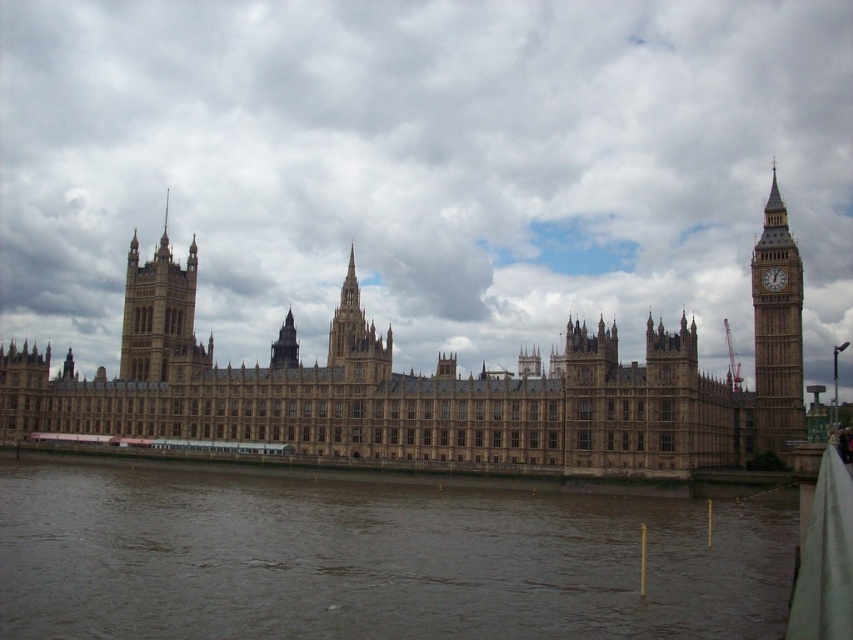
Does brown muddy water at lower left lie behind gold metallic clock at right?

No, brown muddy water at lower left is closer to the viewer.

Measure the distance from brown muddy water at lower left to gold metallic clock at right.

A distance of 138.81 feet exists between brown muddy water at lower left and gold metallic clock at right.

You are a GUI agent. You are given a task and a screenshot of the screen. Output one action in this format:
    pyautogui.click(x=<x>, y=<y>)
    Task: Click on the brown muddy water at lower left
    This screenshot has width=853, height=640.
    Given the screenshot: What is the action you would take?
    pyautogui.click(x=373, y=561)

Who is positioned more to the left, brown stone castle at center or golden stone spire at center?

brown stone castle at center

Can you confirm if brown stone castle at center is positioned above golden stone spire at center?

Actually, brown stone castle at center is below golden stone spire at center.

Is point (277, 346) less distant than point (339, 316)?

No, it is behind (339, 316).

The height and width of the screenshot is (640, 853). I want to click on brown stone castle at center, so click(x=384, y=396).

Can you confirm if white fluffy cloud at upper center is smaller than brown stone tower at upper left?

No.

Which is more to the right, white fluffy cloud at upper center or brown stone tower at upper left?

white fluffy cloud at upper center

Does point (444, 65) lie in front of point (189, 289)?

Yes, it is in front of point (189, 289).

This screenshot has height=640, width=853. What are the coordinates of `white fluffy cloud at upper center` in the screenshot? It's located at (424, 166).